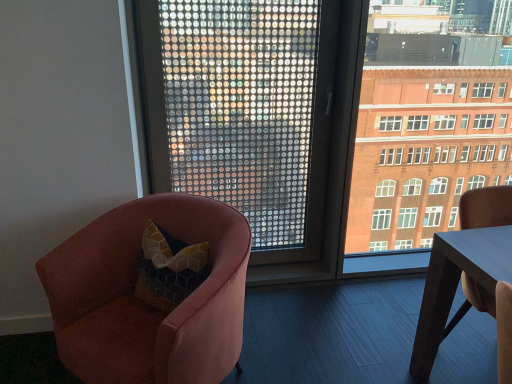
I want to click on vacant area that lies to the right of velvet pink armchair at left, so click(x=304, y=346).